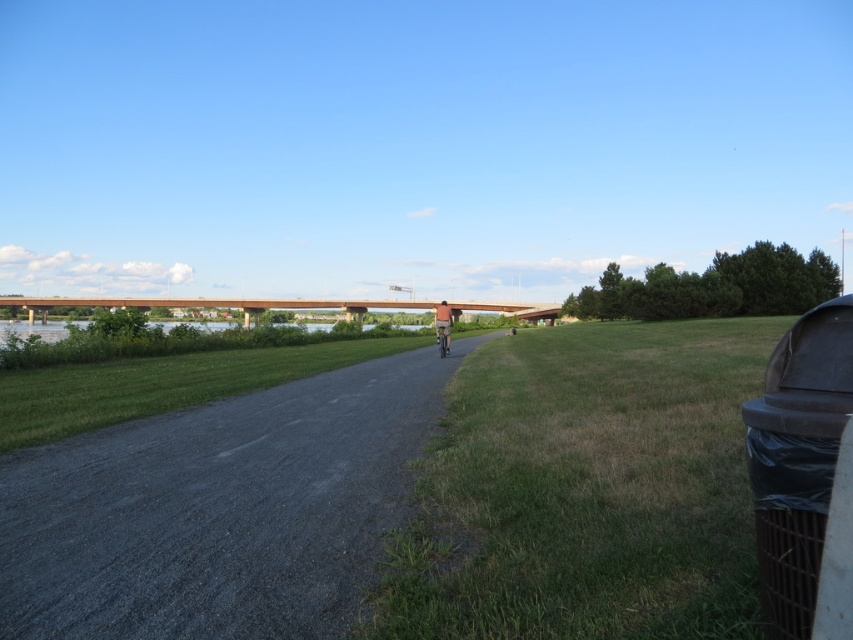
You are standing at the center of the paved path and see the green grass at center and the denim jacket at center. Which object is positioned to the right of the other?

The green grass at center is to the right of the denim jacket at center.

You are standing at the point marked by the coordinates point (585, 490) which is green grass at center. You want to walk to the bridge. Which direction should you head towards?

The bridge is located in the distance where the path meets it, so you should head towards the direction the path leads, which is away from the green grass at center towards the bridge.

You are a delivery person who needs to place a box on the gray gravel path at center. However, the box is as tall as the metallic silver bicycle at center. Will the box be visible from above the path?

The gray gravel path at center has a lesser height compared to metallic silver bicycle at center. Since the box is as tall as the bicycle, it will be taller than the path, so the box will be visible from above the path.